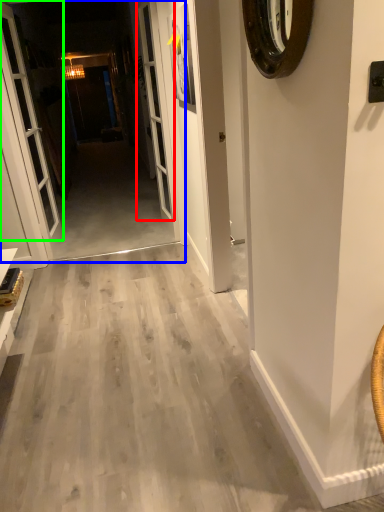
Question: Based on their relative distances, which object is farther from screen door (highlighted by a red box)? Choose from corridor (highlighted by a blue box) and door (highlighted by a green box).

Choices:
 (A) corridor
 (B) door

Answer: (A)